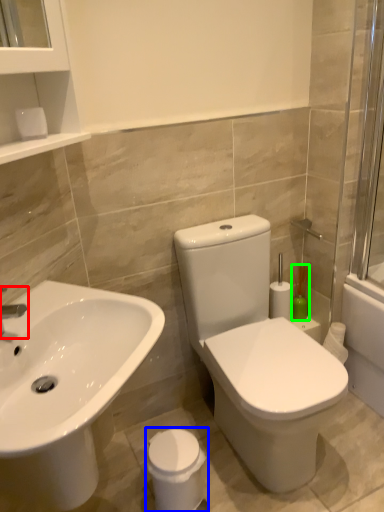
Question: Estimate the real-world distances between objects in this image. Which object is closer to tap (highlighted by a red box), porcelain (highlighted by a blue box) or soap dispenser (highlighted by a green box)?

Choices:
 (A) porcelain
 (B) soap dispenser

Answer: (A)